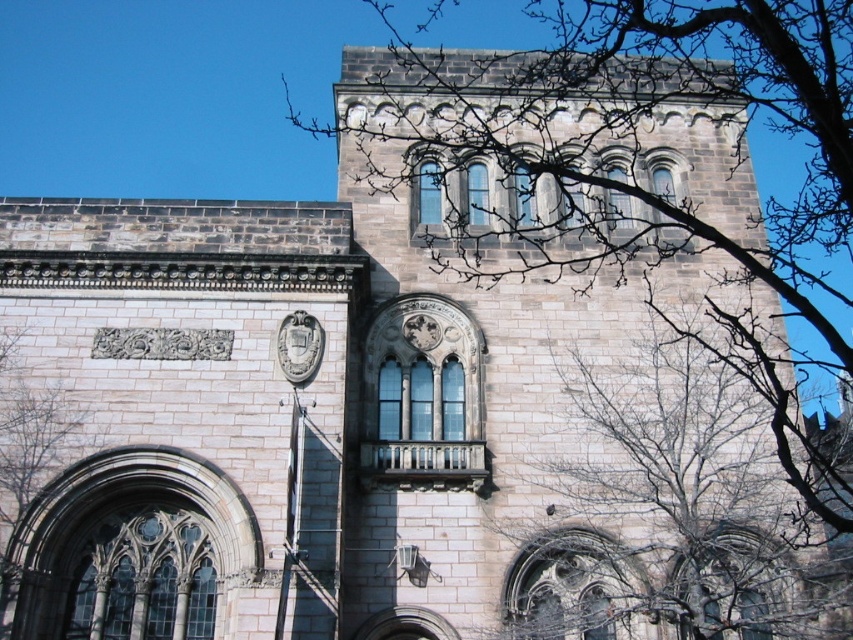
You are standing in front of the historic stone building and notice the bare branches at center. Based on their position, can you determine if they are closer to the ground or the top of the building?

The bare branches at center are located at point coordinates that are closer to the bottom of the image, indicating they are nearer to the ground level of the building.

Consider the image. You are standing in front of the historic stone building and want to take a photo. You notice two points marked on the building at coordinates point [834,618] and point [30,417]. Which point is closer to your camera position?

Point [30,417] is closer to the camera because the description states that point [834,618] is further away from the camera compared to point [30,417].

Looking at this image, you are a bird looking for a place to perch. You see two options in the image, the bare branches at center and the bare branches at left. Which one would provide a larger perch area?

The bare branches at center is bigger than the bare branches at left, so it would provide a larger perch area.